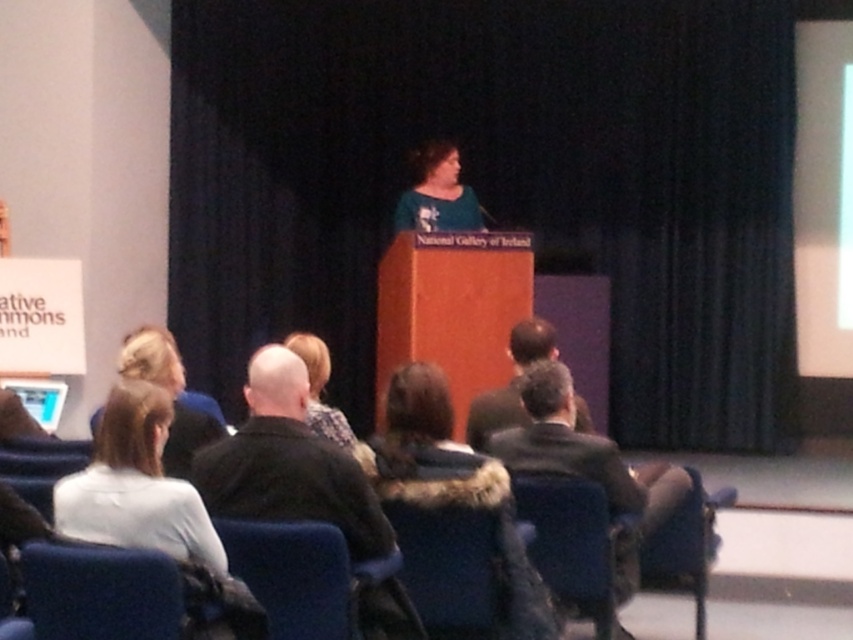
Question: Which point appears farthest from the camera in this image?

Choices:
 (A) (x=701, y=636)
 (B) (x=444, y=486)
 (C) (x=662, y=470)

Answer: (A)

Question: Does dark blue fabric chair at lower left appear on the left side of matte blue chair at lower center?

Choices:
 (A) yes
 (B) no

Answer: (A)

Question: Which point is farther to the camera?

Choices:
 (A) matte blue chair at lower center
 (B) teal fabric dress at center
 (C) velvet blue chair at lower center
 (D) blue fabric chair at lower center

Answer: (B)

Question: Does velvet blue chair at lower center come behind blue fabric chair at lower right?

Choices:
 (A) no
 (B) yes

Answer: (A)

Question: Is blue fabric chair at lower center to the left of blue fabric chair at lower right from the viewer's perspective?

Choices:
 (A) yes
 (B) no

Answer: (A)

Question: Among these points, which one is farthest from the camera?

Choices:
 (A) (207, 563)
 (B) (653, 580)
 (C) (453, 451)

Answer: (B)